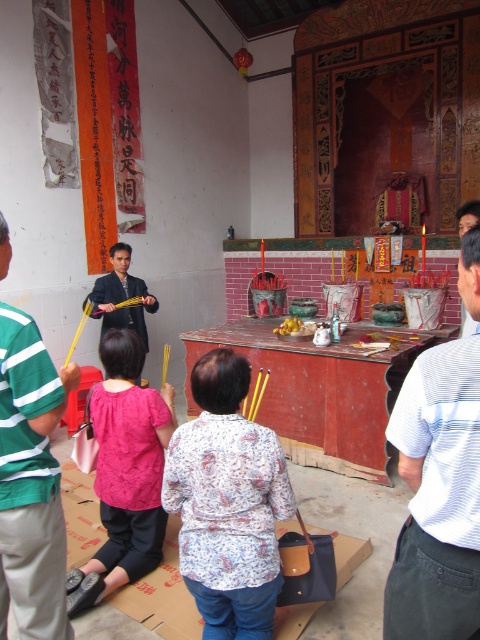
Looking at this image, between white striped shirt at right and floral-patterned blouse at center, which one has less height?

With less height is floral-patterned blouse at center.

Is point (474, 438) farther from camera compared to point (243, 531)?

No, it is in front of (243, 531).

Does point (441, 417) lie in front of point (276, 550)?

Yes, point (441, 417) is in front of point (276, 550).

Locate an element on the screen. The width and height of the screenshot is (480, 640). white striped shirt at right is located at coordinates (437, 497).

Measure the distance between floral-patterned blouse at center and matte pink blouse at lower left.

floral-patterned blouse at center is 23.29 inches away from matte pink blouse at lower left.

Between point (216, 586) and point (115, 410), which one is positioned behind?

Positioned behind is point (115, 410).

Is point (274, 522) farther from viewer compared to point (105, 486)?

That is False.

Find the location of a particular element. This screenshot has height=640, width=480. floral-patterned blouse at center is located at coordinates (228, 502).

Is white striped shirt at right smaller than matte pink blouse at lower left?

Yes.

Which is in front, point (445, 596) or point (116, 568)?

Point (445, 596) is more forward.

Where is `white striped shirt at right`? This screenshot has width=480, height=640. white striped shirt at right is located at coordinates click(437, 497).